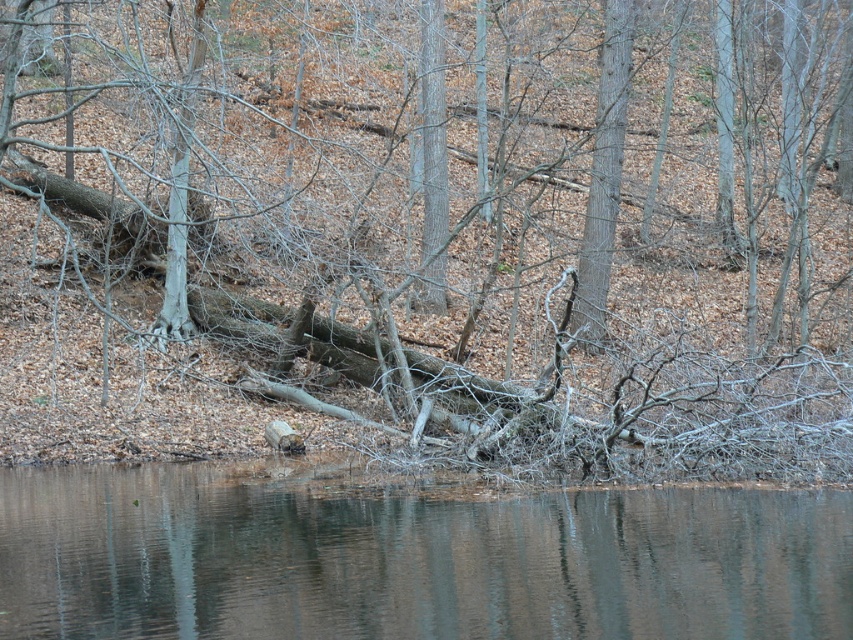
Question: Which point is farther to the camera?

Choices:
 (A) (91, 51)
 (B) (189, 618)
 (C) (595, 323)

Answer: (A)

Question: Which object is the closest to the smooth bark tree at center?

Choices:
 (A) brown wood tree at center
 (B) brown smooth water at lower center

Answer: (A)

Question: Is the position of brown wood tree at center more distant than that of smooth bark tree at center?

Choices:
 (A) no
 (B) yes

Answer: (A)

Question: Among these objects, which one is farthest from the camera?

Choices:
 (A) brown wood tree at center
 (B) smooth bark tree at center
 (C) brown smooth water at lower center

Answer: (B)

Question: Does brown wood tree at center lie behind smooth bark tree at center?

Choices:
 (A) no
 (B) yes

Answer: (A)

Question: Is brown wood tree at center positioned in front of smooth bark tree at center?

Choices:
 (A) no
 (B) yes

Answer: (B)